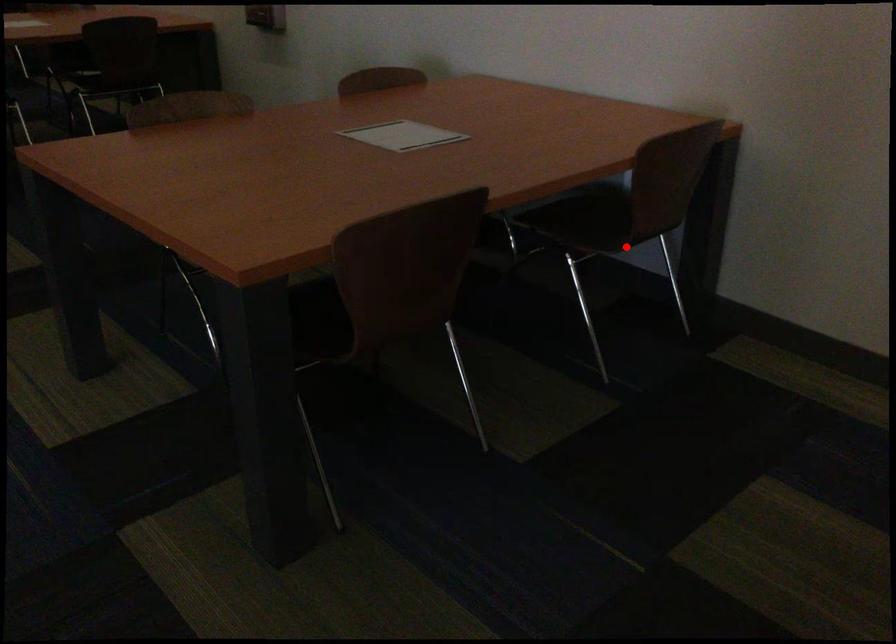
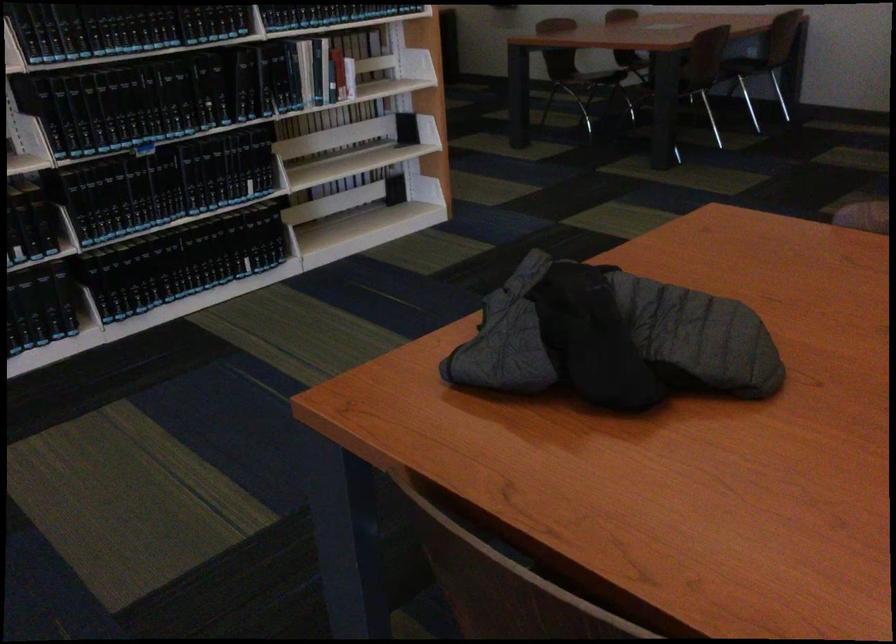
Question: I am providing you with two images of the same scene from different viewpoints. Image1 has a red point marked. In image2, the corresponding 3D location appears at what relative position? Reply with the corresponding letter.

Choices:
 (A) Closer
 (B) Farther

Answer: (B)